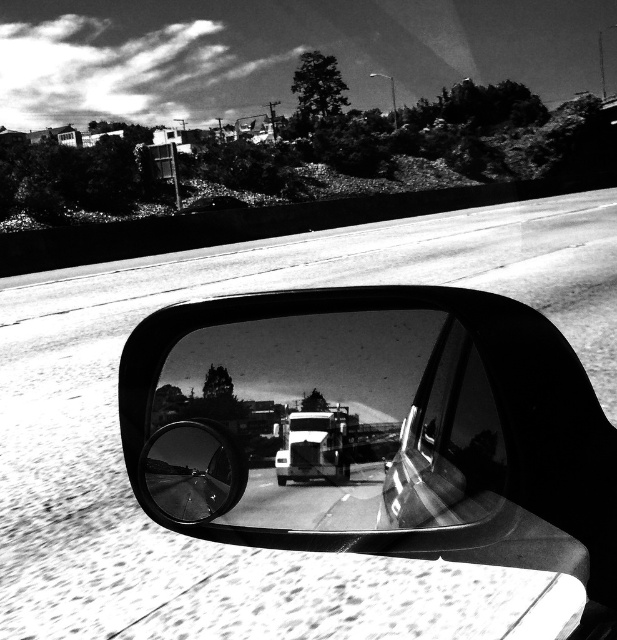
Is point (180, 500) closer to viewer compared to point (336, 465)?

No, it is behind (336, 465).

Is point (231, 502) farther from camera compared to point (329, 419)?

Yes, it is behind point (329, 419).

Does point (155, 448) come closer to viewer compared to point (336, 477)?

No.

Find the location of a particular element. This screenshot has width=617, height=640. shiny chrome mirror at center is located at coordinates (193, 470).

Who is positioned more to the left, polished chrome car window at center or shiny chrome mirror at center?

shiny chrome mirror at center

This screenshot has height=640, width=617. What do you see at coordinates (445, 444) in the screenshot?
I see `polished chrome car window at center` at bounding box center [445, 444].

The image size is (617, 640). I want to click on polished chrome car window at center, so click(445, 444).

Between polished chrome car window at center and metallic silver trailer truck at center, which one appears on the left side from the viewer's perspective?

From the viewer's perspective, metallic silver trailer truck at center appears more on the left side.

Which is more to the right, polished chrome car window at center or metallic silver trailer truck at center?

From the viewer's perspective, polished chrome car window at center appears more on the right side.

Locate an element on the screen. polished chrome car window at center is located at coordinates (445, 444).

Locate an element on the screen. polished chrome car window at center is located at coordinates (445, 444).